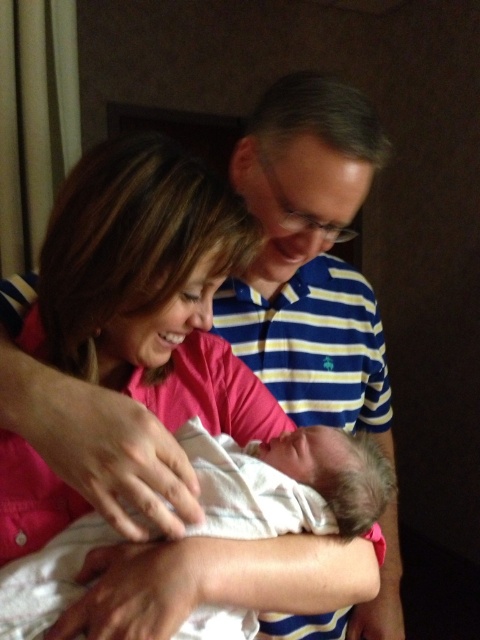
Can you confirm if blue striped shirt at upper center is positioned below white soft cloth at center?

No, blue striped shirt at upper center is not below white soft cloth at center.

Is blue striped shirt at upper center above white soft cloth at center?

Yes, blue striped shirt at upper center is above white soft cloth at center.

Is point (388, 628) positioned after point (330, 506)?

Yes, point (388, 628) is behind point (330, 506).

At what (x,y) coordinates should I click in order to perform the action: click on blue striped shirt at upper center. Please return your answer as a coordinate pair (x, y). Looking at the image, I should click on (310, 257).